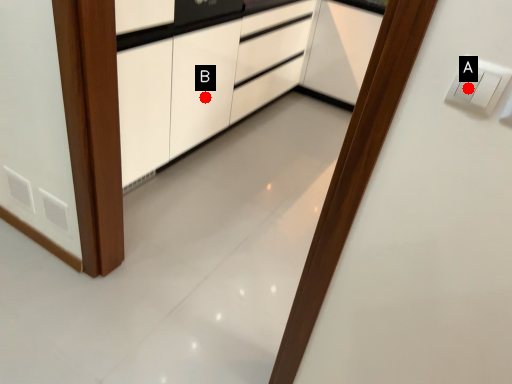
Question: Two points are circled on the image, labeled by A and B beside each circle. Which point appears farthest from the camera in this image?

Choices:
 (A) A is further
 (B) B is further

Answer: (B)